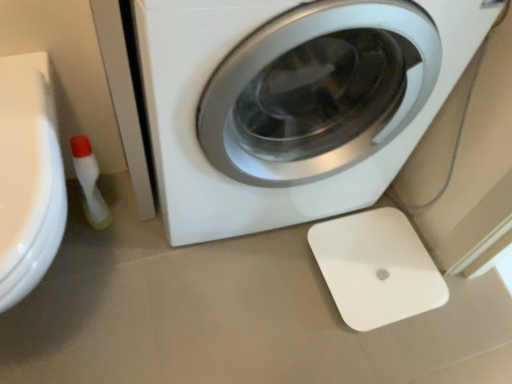
Question: Does white plastic scale at lower right appear on the right side of white glossy washing machine at center?

Choices:
 (A) yes
 (B) no

Answer: (A)

Question: Is white plastic scale at lower right aimed at white glossy washing machine at center?

Choices:
 (A) no
 (B) yes

Answer: (A)

Question: From the image's perspective, is white plastic scale at lower right below white glossy washing machine at center?

Choices:
 (A) yes
 (B) no

Answer: (A)

Question: Can you confirm if white plastic scale at lower right is bigger than white glossy washing machine at center?

Choices:
 (A) no
 (B) yes

Answer: (A)

Question: From the image's perspective, is white plastic scale at lower right on white glossy washing machine at center?

Choices:
 (A) yes
 (B) no

Answer: (B)

Question: Is white glossy washing machine at center completely or partially inside white plastic scale at lower right?

Choices:
 (A) no
 (B) yes

Answer: (A)

Question: Is the position of white plastic scale at lower right less distant than that of translucent plastic bottle at lower left?

Choices:
 (A) no
 (B) yes

Answer: (A)

Question: Can you confirm if white plastic scale at lower right is bigger than translucent plastic bottle at lower left?

Choices:
 (A) no
 (B) yes

Answer: (A)

Question: Is white plastic scale at lower right at the right side of translucent plastic bottle at lower left?

Choices:
 (A) yes
 (B) no

Answer: (A)

Question: From the image's perspective, would you say white plastic scale at lower right is shown under translucent plastic bottle at lower left?

Choices:
 (A) yes
 (B) no

Answer: (A)

Question: Is white plastic scale at lower right aimed at translucent plastic bottle at lower left?

Choices:
 (A) yes
 (B) no

Answer: (B)

Question: Does white plastic scale at lower right have a greater width compared to translucent plastic bottle at lower left?

Choices:
 (A) yes
 (B) no

Answer: (A)

Question: Is translucent plastic bottle at lower left outside of white plastic scale at lower right?

Choices:
 (A) yes
 (B) no

Answer: (A)